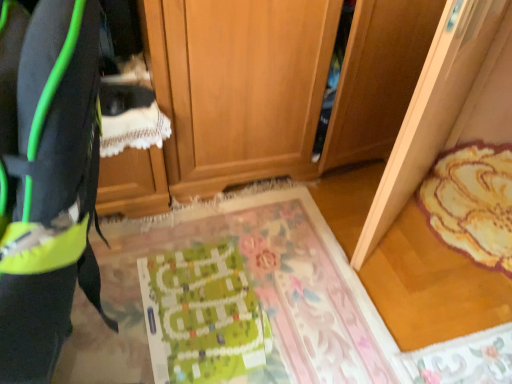
Question: Is green paper at center at the back of green fabric mat at center, which is the second mat in right-to-left order?

Choices:
 (A) yes
 (B) no

Answer: (B)

Question: Considering the relative sizes of green fabric mat at center, which is the second mat in right-to-left order, and green paper at center in the image provided, is green fabric mat at center, which is the second mat in right-to-left order, bigger than green paper at center?

Choices:
 (A) yes
 (B) no

Answer: (A)

Question: Can you confirm if green fabric mat at center, which is the second mat in right-to-left order, is wider than green paper at center?

Choices:
 (A) yes
 (B) no

Answer: (A)

Question: Can you confirm if green fabric mat at center, arranged as the 1th mat when viewed from the left, is smaller than green paper at center?

Choices:
 (A) no
 (B) yes

Answer: (A)

Question: From the image's perspective, would you say green fabric mat at center, which is the second mat in right-to-left order, is positioned over green paper at center?

Choices:
 (A) yes
 (B) no

Answer: (A)

Question: Is floral fabric rug at right, which ranks as the 2th mat in left-to-right order, taller or shorter than neon green fabric at left?

Choices:
 (A) short
 (B) tall

Answer: (A)

Question: Considering the positions of point pyautogui.click(x=508, y=187) and point pyautogui.click(x=10, y=248), is point pyautogui.click(x=508, y=187) closer or farther from the camera than point pyautogui.click(x=10, y=248)?

Choices:
 (A) farther
 (B) closer

Answer: (A)

Question: Relative to neon green fabric at left, is floral fabric rug at right, which ranks as the 2th mat in left-to-right order, in front or behind?

Choices:
 (A) behind
 (B) front

Answer: (A)

Question: From the image's perspective, is floral fabric rug at right, which ranks as the 2th mat in left-to-right order, positioned above or below neon green fabric at left?

Choices:
 (A) below
 (B) above

Answer: (B)

Question: Is floral fabric rug at right, which ranks as the 2th mat in left-to-right order, inside the boundaries of green paper at center, or outside?

Choices:
 (A) outside
 (B) inside

Answer: (A)

Question: In terms of height, does floral fabric rug at right, positioned as the first mat in right-to-left order, look taller or shorter compared to green paper at center?

Choices:
 (A) short
 (B) tall

Answer: (B)

Question: From a real-world perspective, is floral fabric rug at right, positioned as the first mat in right-to-left order, above or below green paper at center?

Choices:
 (A) above
 (B) below

Answer: (A)

Question: Based on their sizes in the image, would you say floral fabric rug at right, positioned as the first mat in right-to-left order, is bigger or smaller than green paper at center?

Choices:
 (A) small
 (B) big

Answer: (B)

Question: In terms of size, does wooden cabinet at center appear bigger or smaller than neon green fabric at left?

Choices:
 (A) big
 (B) small

Answer: (A)

Question: Is wooden cabinet at center in front of or behind neon green fabric at left in the image?

Choices:
 (A) behind
 (B) front

Answer: (A)